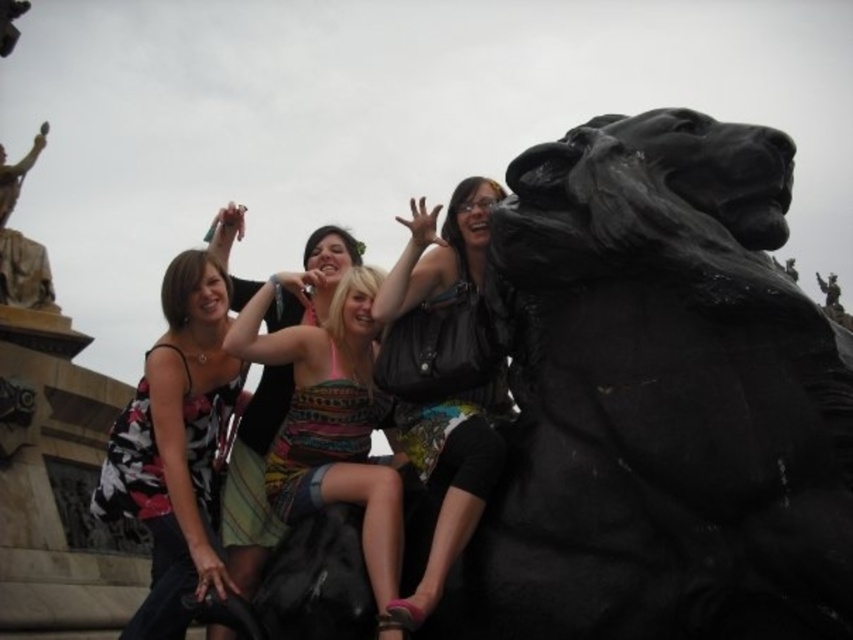
You are a photographer trying to capture the group of people on the lion statue. You notice the patterned fabric dress at center and the bronze statue at upper left. Which object is positioned to the right of the other?

The patterned fabric dress at center is to the right of the bronze statue at upper left.